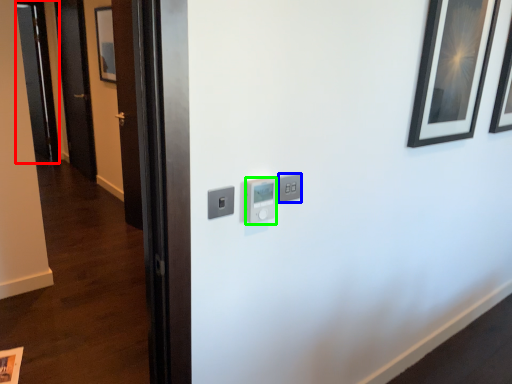
Question: Which object is positioned closest to glass door (highlighted by a red box)? Select from light switch (highlighted by a blue box) and light switch (highlighted by a green box).

Choices:
 (A) light switch
 (B) light switch

Answer: (B)